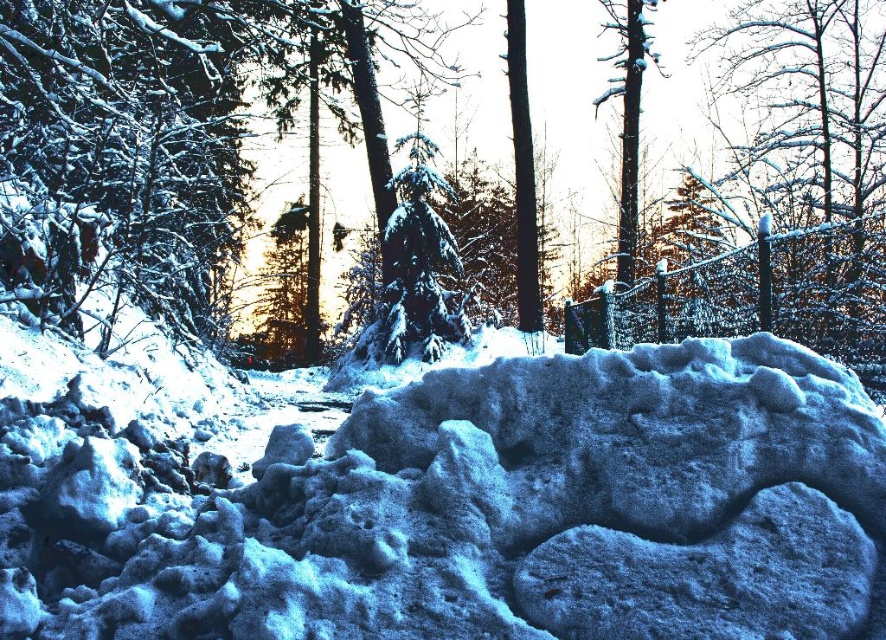
Does white frosty mound at center have a greater width compared to snow-covered tree trunk at center?

Yes.

This screenshot has width=886, height=640. I want to click on white frosty mound at center, so click(x=490, y=513).

Is point (192, 600) farther from viewer compared to point (618, 220)?

No, (192, 600) is closer to viewer.

Identify the location of white frosty mound at center. The height and width of the screenshot is (640, 886). (490, 513).

Is the position of white frosty mound at center more distant than that of white frosty tree at upper right?

That is False.

Is point (157, 508) in front of point (833, 148)?

Yes, point (157, 508) is closer to viewer.

Is point (420, 508) closer to viewer compared to point (853, 333)?

Yes, it is.

At what (x,y) coordinates should I click in order to perform the action: click on white frosty mound at center. Please return your answer as a coordinate pair (x, y). Image resolution: width=886 pixels, height=640 pixels. Looking at the image, I should click on point(490,513).

The image size is (886, 640). What do you see at coordinates (490, 513) in the screenshot?
I see `white frosty mound at center` at bounding box center [490, 513].

Between point (735, 444) and point (509, 90), which one is positioned in front?

Positioned in front is point (735, 444).

Which is in front, point (418, 474) or point (519, 248)?

Positioned in front is point (418, 474).

You are a GUI agent. You are given a task and a screenshot of the screen. Output one action in this format:
    pyautogui.click(x=<x>, y=<y>)
    Task: Click on the white frosty mound at center
    
    Given the screenshot: What is the action you would take?
    pyautogui.click(x=490, y=513)